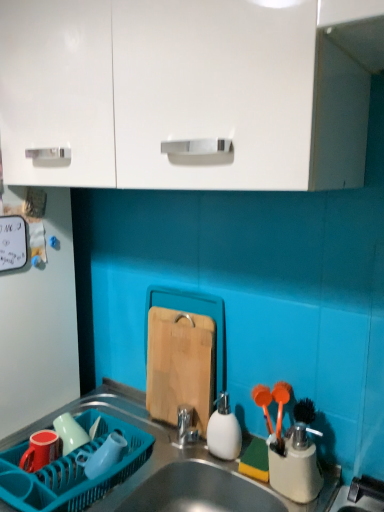
In order to click on vacant space positioned to the left of white matte soap dispenser at center, the first tableware when ordered from right to left in this screenshot , I will do `click(156, 443)`.